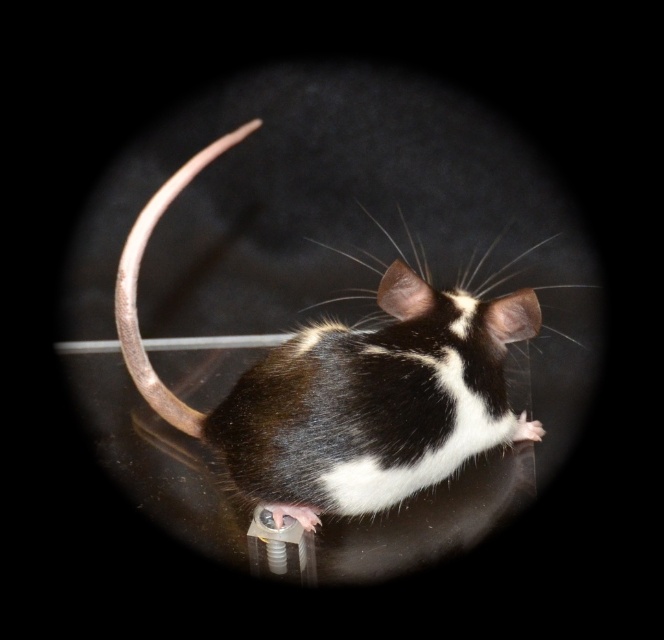
Question: Which point is closer to the camera taking this photo?

Choices:
 (A) (175, 416)
 (B) (503, 337)

Answer: (B)

Question: Which point is closer to the camera?

Choices:
 (A) click(x=290, y=388)
 (B) click(x=120, y=316)

Answer: (A)

Question: Does black fur mouse at center appear on the left side of metallic tail at center?

Choices:
 (A) yes
 (B) no

Answer: (B)

Question: Can you confirm if black fur mouse at center is positioned to the left of metallic tail at center?

Choices:
 (A) no
 (B) yes

Answer: (A)

Question: Does black fur mouse at center have a greater width compared to metallic tail at center?

Choices:
 (A) no
 (B) yes

Answer: (B)